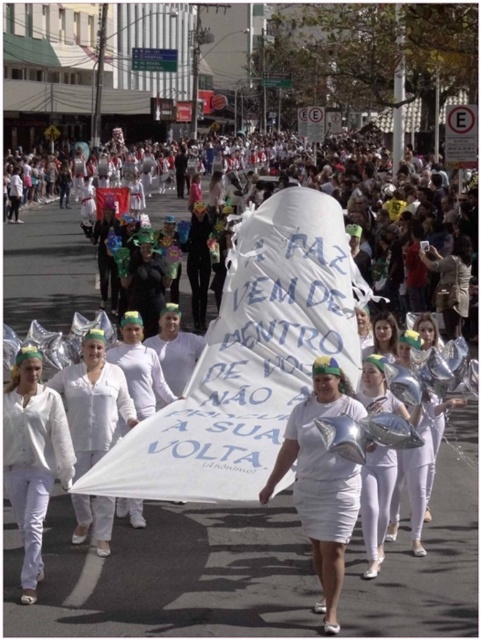
You are a photographer positioned on the street and want to capture both the white matte dress at center and the white matte uniform at center in a single shot. Which object should you frame first to ensure both are visible in the photo?

You should frame the white matte uniform at center first because the white matte dress at center is to the right of it, ensuring both are included in the shot.

You are a photographer at the parade. You want to take a photo that highlights both the white fabric banner at center and the white matte uniform at center. Since both are white, how can you ensure the banner stands out more in the photo?

The white fabric banner at center has a larger size compared to the white matte uniform at center, so you can use the size difference to make the banner more prominent in the photo.

You are a photographer positioned on the street during the parade. You need to capture a photo that includes both the white matte dress at center and the white matte uniform at center. Which one will appear lower in the photo?

The white matte dress at center will appear lower in the photo because it is positioned below the white matte uniform at center.